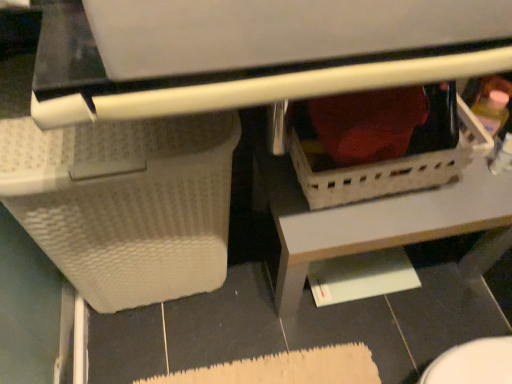
What do you see at coordinates (391, 160) in the screenshot?
I see `white plastic basket at center, positioned as the first basket in right-to-left order` at bounding box center [391, 160].

Describe the element at coordinates (444, 313) in the screenshot. I see `black glossy tile at lower right` at that location.

Locate an element on the screen. white textured basket at lower left, which appears as the second basket when viewed from the right is located at coordinates (125, 203).

The image size is (512, 384). What are the coordinates of `white plastic basket at center, the 2th basket when ordered from left to right` in the screenshot? It's located at (391, 160).

Looking at this image, is white textured basket at lower left, marked as the first basket in a left-to-right arrangement, not within black glossy tile at lower right?

Yes, white textured basket at lower left, marked as the first basket in a left-to-right arrangement, is outside of black glossy tile at lower right.

Can you confirm if white textured basket at lower left, marked as the first basket in a left-to-right arrangement, is positioned to the right of black glossy tile at lower right?

In fact, white textured basket at lower left, marked as the first basket in a left-to-right arrangement, is to the left of black glossy tile at lower right.

Looking at this image, is white textured basket at lower left, marked as the first basket in a left-to-right arrangement, facing away from black glossy tile at lower right?

No, white textured basket at lower left, marked as the first basket in a left-to-right arrangement, is not facing the opposite direction of black glossy tile at lower right.

From the image's perspective, which one is positioned lower, white textured basket at lower left, which appears as the second basket when viewed from the right, or black glossy tile at lower right?

black glossy tile at lower right appears lower in the image.

How many degrees apart are the facing directions of white plastic basket at center, positioned as the first basket in right-to-left order, and white textured basket at lower left, which appears as the second basket when viewed from the right?

The angular difference between white plastic basket at center, positioned as the first basket in right-to-left order, and white textured basket at lower left, which appears as the second basket when viewed from the right, is 0.997 degrees.

Would you say white plastic basket at center, positioned as the first basket in right-to-left order, is outside white textured basket at lower left, which appears as the second basket when viewed from the right?

Yes, white plastic basket at center, positioned as the first basket in right-to-left order, is outside of white textured basket at lower left, which appears as the second basket when viewed from the right.

Where is `basket that is in front of the white plastic basket at center, the 2th basket when ordered from left to right`? basket that is in front of the white plastic basket at center, the 2th basket when ordered from left to right is located at coordinates (125, 203).

Is white plastic basket at center, positioned as the first basket in right-to-left order, positioned far away from white textured basket at lower left, which appears as the second basket when viewed from the right?

white plastic basket at center, positioned as the first basket in right-to-left order, is near white textured basket at lower left, which appears as the second basket when viewed from the right, not far away.

How much distance is there between white plastic basket at lower center and white textured basket at lower left, which appears as the second basket when viewed from the right?

The distance of white plastic basket at lower center from white textured basket at lower left, which appears as the second basket when viewed from the right, is 33.12 centimeters.

From the image's perspective, is white plastic basket at lower center positioned above or below white textured basket at lower left, which appears as the second basket when viewed from the right?

Based on their image positions, white plastic basket at lower center is located above white textured basket at lower left, which appears as the second basket when viewed from the right.

Could you tell me if white plastic basket at lower center is turned towards white textured basket at lower left, which appears as the second basket when viewed from the right?

No, white plastic basket at lower center is not aimed at white textured basket at lower left, which appears as the second basket when viewed from the right.

Does white plastic basket at lower center appear on the right side of white textured basket at lower left, marked as the first basket in a left-to-right arrangement?

Indeed, white plastic basket at lower center is positioned on the right side of white textured basket at lower left, marked as the first basket in a left-to-right arrangement.

Between point (483, 327) and point (304, 222), which one is positioned behind?

The point (483, 327) is farther from the camera.

Can you confirm if black glossy tile at lower right is wider than white plastic basket at lower center?

In fact, black glossy tile at lower right might be narrower than white plastic basket at lower center.

How many degrees apart are the facing directions of black glossy tile at lower right and white plastic basket at lower center?

They differ by 91.2 degrees in their facing directions.

From a real-world perspective, is black glossy tile at lower right under white plastic basket at lower center?

Actually, black glossy tile at lower right is physically above white plastic basket at lower center in the real world.

Consider the image. Is white plastic basket at center, the 2th basket when ordered from left to right, at the right side of white plastic basket at lower center?

No, white plastic basket at center, the 2th basket when ordered from left to right, is not to the right of white plastic basket at lower center.

Which is closer, (373, 185) or (305, 227)?

The point (373, 185) is more forward.

From the image's perspective, which is below, white plastic basket at center, positioned as the first basket in right-to-left order, or white plastic basket at lower center?

white plastic basket at lower center is shown below in the image.

Is white plastic basket at center, positioned as the first basket in right-to-left order, in contact with white plastic basket at lower center?

They are not placed beside each other.

Does white plastic basket at center, positioned as the first basket in right-to-left order, have a lesser height compared to black glossy tile at lower right?

Yes, white plastic basket at center, positioned as the first basket in right-to-left order, is shorter than black glossy tile at lower right.

From the image's perspective, is white plastic basket at center, positioned as the first basket in right-to-left order, below black glossy tile at lower right?

Actually, white plastic basket at center, positioned as the first basket in right-to-left order, appears above black glossy tile at lower right in the image.

Considering the relative sizes of white plastic basket at center, positioned as the first basket in right-to-left order, and black glossy tile at lower right in the image provided, is white plastic basket at center, positioned as the first basket in right-to-left order, smaller than black glossy tile at lower right?

Yes, white plastic basket at center, positioned as the first basket in right-to-left order, is smaller than black glossy tile at lower right.

From a real-world perspective, is white plastic basket at center, the 2th basket when ordered from left to right, physically below black glossy tile at lower right?

No.

From a real-world perspective, does white plastic basket at lower center sit lower than black glossy tile at lower right?

Yes, from a real-world perspective, white plastic basket at lower center is beneath black glossy tile at lower right.

In order to click on tile that appears in front of the white plastic basket at lower center in this screenshot , I will do `click(444, 313)`.

Is white plastic basket at lower center situated inside black glossy tile at lower right or outside?

white plastic basket at lower center is not enclosed by black glossy tile at lower right.

Is white plastic basket at lower center in contact with black glossy tile at lower right?

white plastic basket at lower center and black glossy tile at lower right are clearly separated.

Where is `tile to the right of white textured basket at lower left, marked as the first basket in a left-to-right arrangement`? tile to the right of white textured basket at lower left, marked as the first basket in a left-to-right arrangement is located at coordinates (444, 313).

Locate an element on the screen. basket on the left side of white plastic basket at center, positioned as the first basket in right-to-left order is located at coordinates (125, 203).

When comparing their distances from white textured basket at lower left, which appears as the second basket when viewed from the right, does white plastic basket at center, positioned as the first basket in right-to-left order, or white plastic basket at lower center seem closer?

Based on the image, white plastic basket at lower center appears to be nearer to white textured basket at lower left, which appears as the second basket when viewed from the right.

Looking at the image, which one is located further to white plastic basket at lower center, white plastic basket at center, positioned as the first basket in right-to-left order, or white textured basket at lower left, which appears as the second basket when viewed from the right?

white textured basket at lower left, which appears as the second basket when viewed from the right, lies further to white plastic basket at lower center than the other object.

In the scene shown: Considering their positions, is white plastic basket at center, positioned as the first basket in right-to-left order, positioned closer to white plastic basket at lower center than black glossy tile at lower right?

white plastic basket at center, positioned as the first basket in right-to-left order.

Estimate the real-world distances between objects in this image. Which object is closer to white plastic basket at lower center, white textured basket at lower left, marked as the first basket in a left-to-right arrangement, or white plastic basket at center, the 2th basket when ordered from left to right?

Among the two, white plastic basket at center, the 2th basket when ordered from left to right, is located nearer to white plastic basket at lower center.

When comparing their distances from white plastic basket at center, positioned as the first basket in right-to-left order, does white textured basket at lower left, marked as the first basket in a left-to-right arrangement, or white plastic basket at lower center seem further?

Among the two, white textured basket at lower left, marked as the first basket in a left-to-right arrangement, is located further to white plastic basket at center, positioned as the first basket in right-to-left order.

From the image, which object appears to be farther from white plastic basket at lower center, black glossy tile at lower right or white plastic basket at center, positioned as the first basket in right-to-left order?

Based on the image, black glossy tile at lower right appears to be further to white plastic basket at lower center.

Based on their spatial positions, is black glossy tile at lower right or white plastic basket at center, the 2th basket when ordered from left to right, further from white textured basket at lower left, which appears as the second basket when viewed from the right?

Among the two, black glossy tile at lower right is located further to white textured basket at lower left, which appears as the second basket when viewed from the right.

Considering their positions, is white plastic basket at lower center positioned closer to white plastic basket at center, the 2th basket when ordered from left to right, than black glossy tile at lower right?

white plastic basket at lower center is positioned closer to the anchor white plastic basket at center, the 2th basket when ordered from left to right.

What are the coordinates of `table between white textured basket at lower left, marked as the first basket in a left-to-right arrangement, and black glossy tile at lower right, in the horizontal direction` in the screenshot? It's located at (370, 219).

The width and height of the screenshot is (512, 384). In order to click on basket located between white textured basket at lower left, marked as the first basket in a left-to-right arrangement, and white plastic basket at lower center in the left-right direction in this screenshot , I will do `click(391, 160)`.

The height and width of the screenshot is (384, 512). I want to click on basket situated between white textured basket at lower left, marked as the first basket in a left-to-right arrangement, and black glossy tile at lower right from left to right, so click(391, 160).

Locate an element on the screen. The image size is (512, 384). table between white plastic basket at center, positioned as the first basket in right-to-left order, and black glossy tile at lower right vertically is located at coordinates (370, 219).